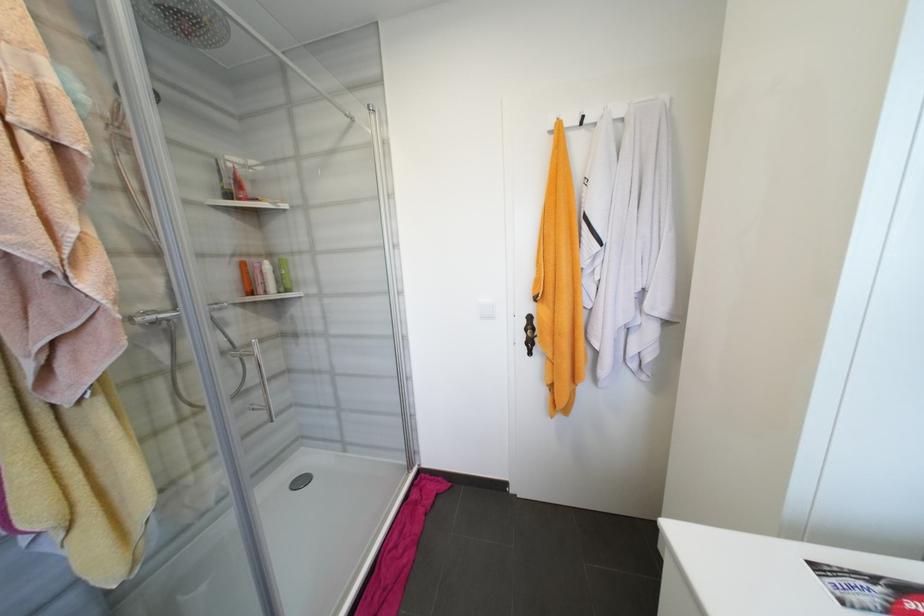
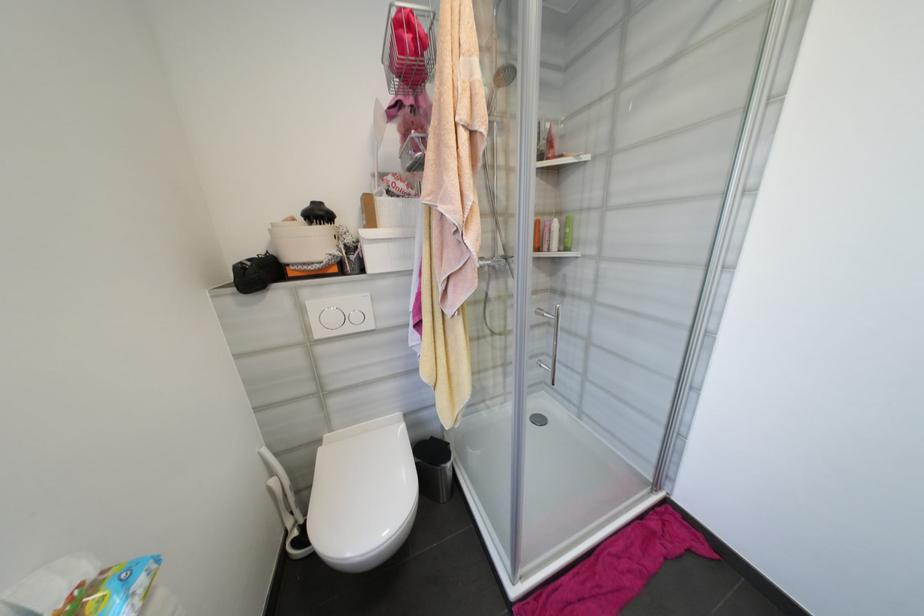
In the second image, find the point that corresponds to (287,291) in the first image.

(567, 249)